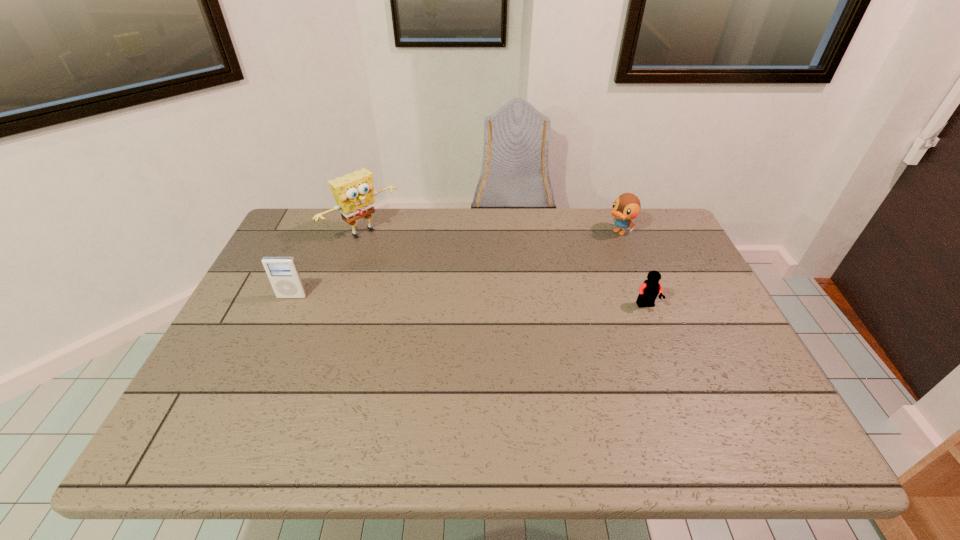
This screenshot has height=540, width=960. Find the location of `free space that is in between the iPod and the duck`. free space that is in between the iPod and the duck is located at coordinates (455, 265).

Find the location of a particular element. free space between the duck and the Lego is located at coordinates click(x=633, y=269).

Find the location of a particular element. This screenshot has width=960, height=540. vacant area that lies between the iPod and the duck is located at coordinates (455, 265).

Identify the location of free space between the iPod and the tallest object. (327, 265).

The image size is (960, 540). I want to click on free area in between the shortest object and the iPod, so click(469, 301).

Locate an element on the screen. vacant space that is in between the duck and the sponge is located at coordinates (492, 232).

You are a GUI agent. You are given a task and a screenshot of the screen. Output one action in this format:
    pyautogui.click(x=<x>, y=<y>)
    Task: Click on the free space between the second nearest object and the duck
    The height and width of the screenshot is (540, 960).
    Given the screenshot: What is the action you would take?
    pyautogui.click(x=455, y=265)

Locate which object is the second closest to the third farthest object. Please provide its 2D coordinates. Your answer should be formatted as a tuple, i.e. [(x, y)], where the tuple contains the x and y coordinates of a point satisfying the conditions above.

[(648, 291)]

The width and height of the screenshot is (960, 540). Identify the location of object that is the third closest to the duck. (282, 272).

What are the coordinates of `vacant space that satisfies the following two spatial constraints: 1. on the back side of the duck; 2. on the right side of the sponge` in the screenshot? It's located at (364, 232).